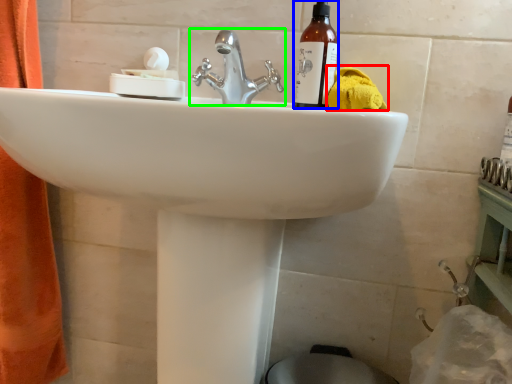
Question: Which object is the closest to the bath towel (highlighted by a red box)? Choose among these: bottle (highlighted by a blue box) or tap (highlighted by a green box).

Choices:
 (A) bottle
 (B) tap

Answer: (A)